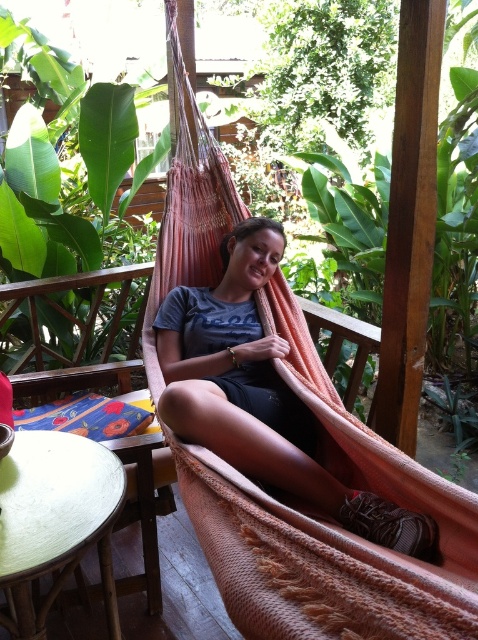
Question: Is pink woven hammock at center to the left of matte pink hammock at center from the viewer's perspective?

Choices:
 (A) yes
 (B) no

Answer: (A)

Question: Does matte pink hammock at center have a larger size compared to wooden chair at center?

Choices:
 (A) yes
 (B) no

Answer: (A)

Question: Which point appears closest to the camera in this image?

Choices:
 (A) (136, 449)
 (B) (288, 376)

Answer: (A)

Question: Does pink woven hammock at center have a lesser width compared to matte pink hammock at center?

Choices:
 (A) yes
 (B) no

Answer: (B)

Question: Which object appears closest to the camera in this image?

Choices:
 (A) wooden chair at center
 (B) pink woven hammock at center

Answer: (B)

Question: Which point is farther to the camera?

Choices:
 (A) (133, 493)
 (B) (218, 413)
 (C) (290, 598)

Answer: (A)